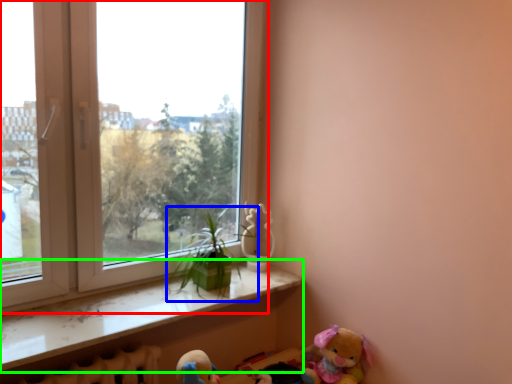
Question: Which object is positioned closest to window (highlighted by a red box)? Select from houseplant (highlighted by a blue box) and window sill (highlighted by a green box).

Choices:
 (A) houseplant
 (B) window sill

Answer: (B)